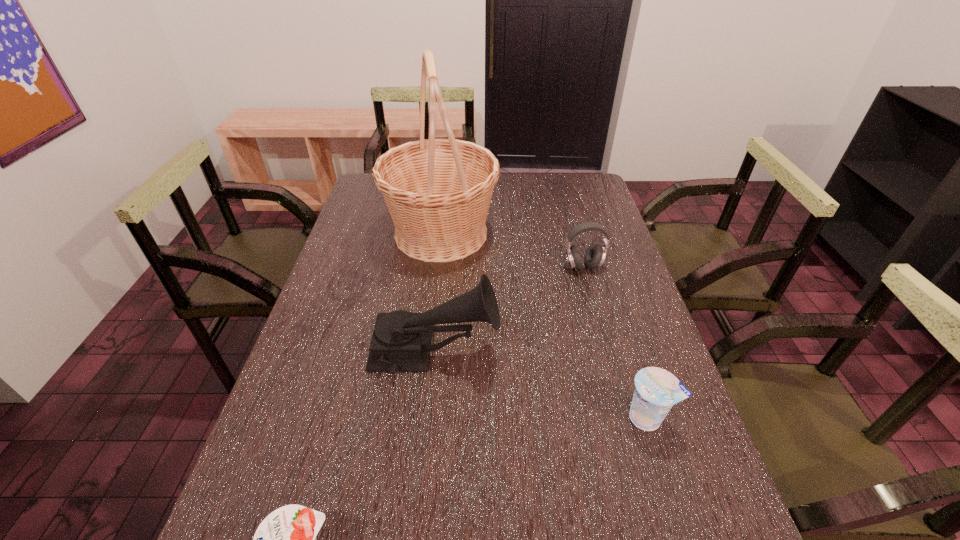
At what (x,y) coordinates should I click in order to perform the action: click on vacant space that satisfies the following two spatial constraints: 1. on the ear cups of the right yogurt; 2. on the left side of the third shortest object. Please return your answer as a coordinate pair (x, y). The height and width of the screenshot is (540, 960). Looking at the image, I should click on (624, 418).

Locate an element on the screen. The width and height of the screenshot is (960, 540). free space in the image that satisfies the following two spatial constraints: 1. from the horn of the third farthest object; 2. on the back side of the second nearest object is located at coordinates (428, 418).